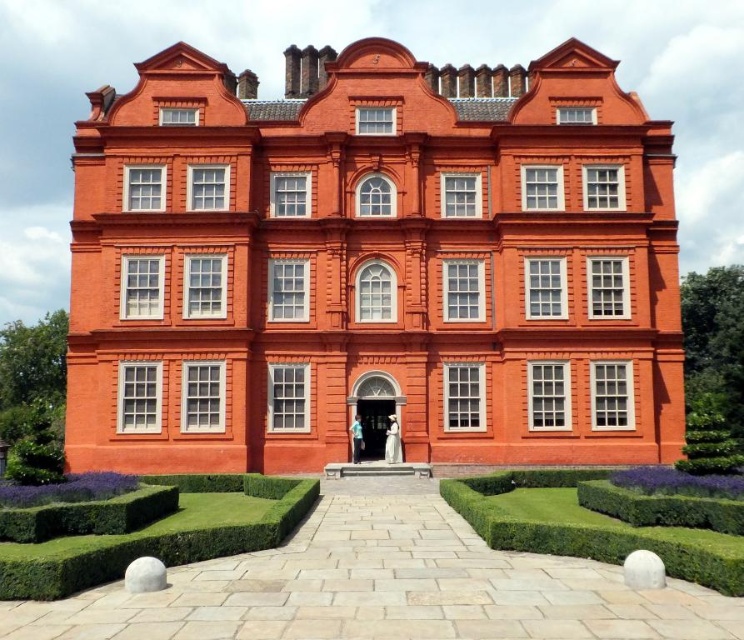
Describe the element at coordinates (89, 515) in the screenshot. I see `green textured hedge at lower left` at that location.

Can you confirm if green textured hedge at lower left is positioned below green leafy hedge at lower right?

Correct, green textured hedge at lower left is located below green leafy hedge at lower right.

Which is in front, point (60, 513) or point (711, 436)?

Point (60, 513) is in front.

Where is `green textured hedge at lower left`? This screenshot has width=744, height=640. green textured hedge at lower left is located at coordinates (89, 515).

What do you see at coordinates (603, 522) in the screenshot? I see `green hedge at lower center` at bounding box center [603, 522].

Which is behind, point (612, 522) or point (4, 550)?

The point (612, 522) is more distant.

Measure the distance between green hedge at lower center and camera.

green hedge at lower center is 36.23 meters away from camera.

Locate an element on the screen. Image resolution: width=744 pixels, height=640 pixels. green hedge at lower center is located at coordinates (603, 522).

Who is taller, green hedge at lower center or green textured hedge at center?

With more height is green hedge at lower center.

Is point (574, 536) farther from camera compared to point (654, 522)?

That is False.

The width and height of the screenshot is (744, 640). Find the location of `green hedge at lower center`. green hedge at lower center is located at coordinates (603, 522).